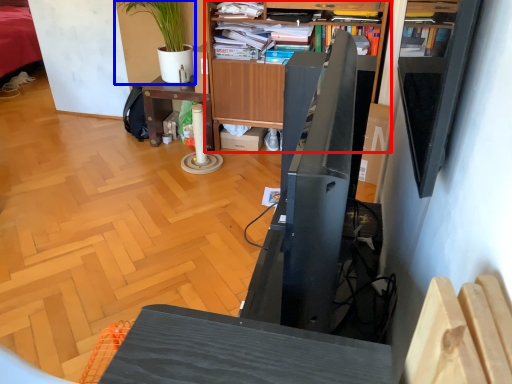
Question: Among these objects, which one is farthest to the camera, bookcase (highlighted by a red box) or houseplant (highlighted by a blue box)?

Choices:
 (A) bookcase
 (B) houseplant

Answer: (B)